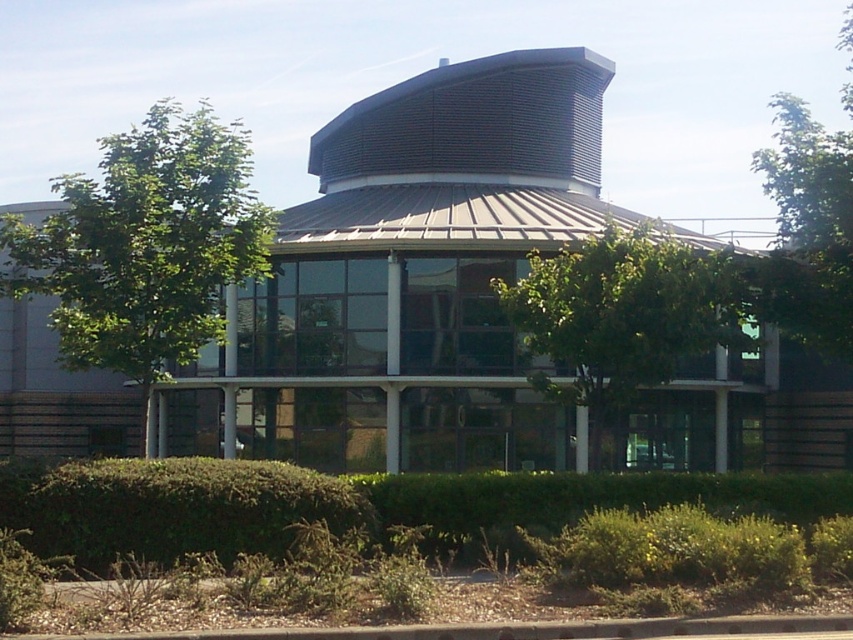
From the picture: Is green leafy tree at left to the left of green leafy bush at lower center from the viewer's perspective?

Correct, you'll find green leafy tree at left to the left of green leafy bush at lower center.

Between green leafy tree at left and green leafy bush at lower center, which one is positioned higher?

green leafy tree at left is above.

Is point (61, 291) more distant than point (312, 506)?

Yes, point (61, 291) is farther from viewer.

Find the location of a particular element. Image resolution: width=853 pixels, height=640 pixels. green leafy tree at left is located at coordinates (144, 246).

Can you confirm if green leafy tree at center is shorter than green leafy tree at upper right?

Yes, green leafy tree at center is shorter than green leafy tree at upper right.

Who is lower down, green leafy tree at center or green leafy tree at upper right?

Positioned lower is green leafy tree at center.

Is point (641, 324) more distant than point (815, 268)?

No, it is in front of (815, 268).

Find the location of a particular element. The image size is (853, 640). green leafy tree at center is located at coordinates (624, 314).

Who is higher up, green leafy tree at center or green leafy bush at lower center?

green leafy tree at center is higher up.

Is green leafy tree at center above green leafy bush at lower center?

Indeed, green leafy tree at center is positioned over green leafy bush at lower center.

You are a GUI agent. You are given a task and a screenshot of the screen. Output one action in this format:
    pyautogui.click(x=<x>, y=<y>)
    Task: Click on the green leafy tree at center
    The width and height of the screenshot is (853, 640).
    Given the screenshot: What is the action you would take?
    pyautogui.click(x=624, y=314)